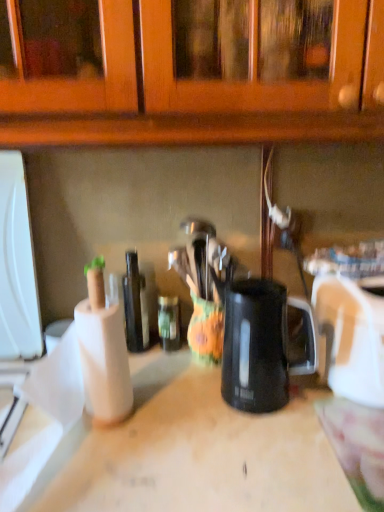
The width and height of the screenshot is (384, 512). Identify the location of free space in front of green glass bottle at center, the 1th bottle positioned from the right. (170, 383).